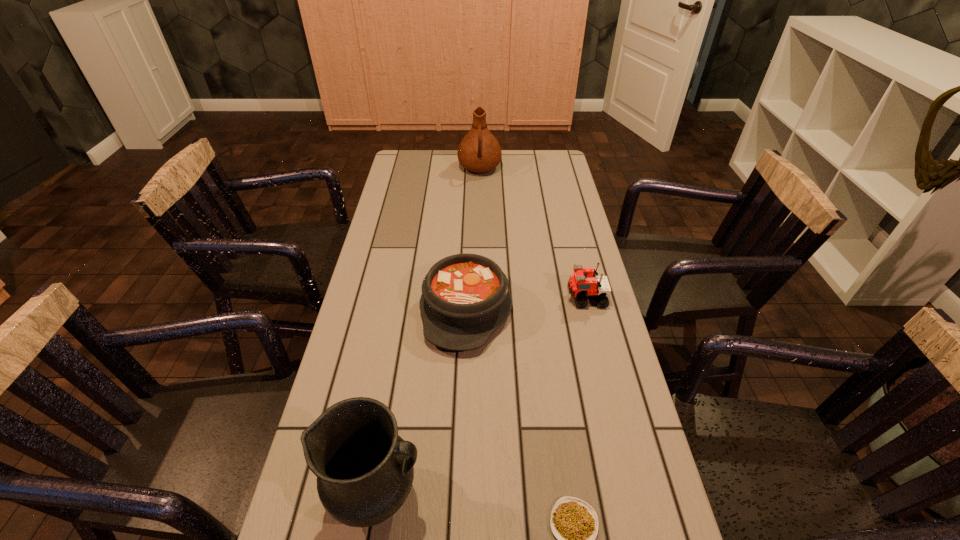
At what (x,y) coordinates should I click in order to perform the action: click on the farther pitcher. Please return your answer as a coordinate pair (x, y). This screenshot has width=960, height=540. Looking at the image, I should click on (479, 152).

The image size is (960, 540). Identify the location of the right pitcher. (479, 152).

Image resolution: width=960 pixels, height=540 pixels. In order to click on casserole in this screenshot , I will do `click(465, 297)`.

Image resolution: width=960 pixels, height=540 pixels. I want to click on Lego, so click(x=580, y=287).

Locate an element on the screen. The height and width of the screenshot is (540, 960). free space located on the side of the right pitcher with the handle is located at coordinates (479, 234).

You are a GUI agent. You are given a task and a screenshot of the screen. Output one action in this format:
    pyautogui.click(x=<x>, y=<y>)
    Task: Click on the vacant space located 0.380m on the back of the casserole
    
    Given the screenshot: What is the action you would take?
    pyautogui.click(x=469, y=201)

This screenshot has width=960, height=540. In order to click on blank space located on the front-facing side of the rightmost object in this screenshot , I will do `click(526, 298)`.

This screenshot has height=540, width=960. In order to click on vacant area located on the front-facing side of the rightmost object in this screenshot , I will do `click(435, 298)`.

You are a GUI agent. You are given a task and a screenshot of the screen. Output one action in this format:
    pyautogui.click(x=<x>, y=<y>)
    Task: Click on the vacant region located 0.400m on the front-facing side of the rightmost object
    Image resolution: width=960 pixels, height=540 pixels.
    Given the screenshot: What is the action you would take?
    pyautogui.click(x=432, y=298)

Locate an element on the screen. object located at the far edge is located at coordinates (479, 152).